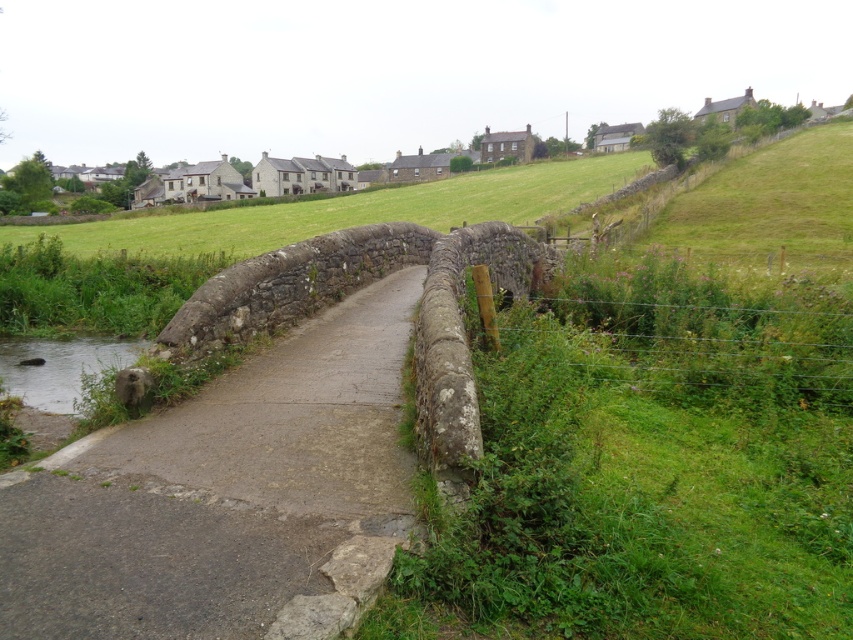
Question: Does gray concrete path at center come behind clear water at lower left?

Choices:
 (A) no
 (B) yes

Answer: (A)

Question: Which point appears closest to the camera in this image?

Choices:
 (A) (120, 342)
 (B) (796, 282)

Answer: (B)

Question: Among these objects, which one is farthest from the camera?

Choices:
 (A) clear water at lower left
 (B) gray concrete path at center
 (C) wire mesh fence at right

Answer: (A)

Question: Estimate the real-world distances between objects in this image. Which object is farther from the clear water at lower left?

Choices:
 (A) wire mesh fence at right
 (B) gray concrete path at center

Answer: (B)

Question: Can you confirm if wire mesh fence at right is positioned below clear water at lower left?

Choices:
 (A) no
 (B) yes

Answer: (A)

Question: Is wire mesh fence at right to the right of clear water at lower left from the viewer's perspective?

Choices:
 (A) no
 (B) yes

Answer: (B)